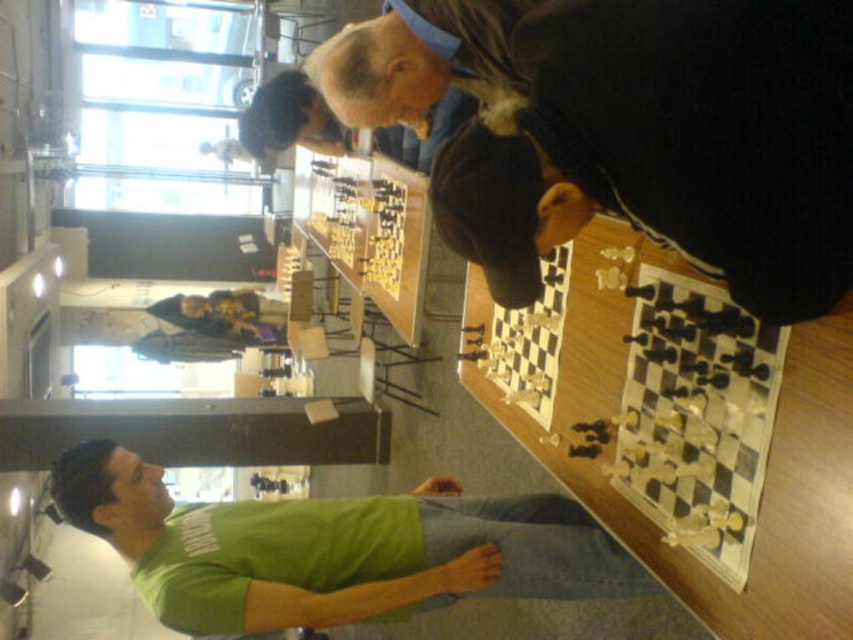
You are standing in the room and want to place a chess piece on the black matte chessboard at upper center. Based on the coordinates provided, can you determine the exact position where the chessboard is located?

The black matte chessboard at upper center is located at point coordinates of 0.206 in the x and 0.736 in the y axis.

Consider the image. You are a delivery robot that is 3 feet wide. You need to deliver a package to the black matte chessboard at upper center. There is a green matte shirt at lower left nearby. Can you navigate between them without hitting either?

The distance between the black matte chessboard at upper center and the green matte shirt at lower left is 4.04 feet, which is wider than the robot width of 3 feet. Therefore, the robot can navigate between them safely.